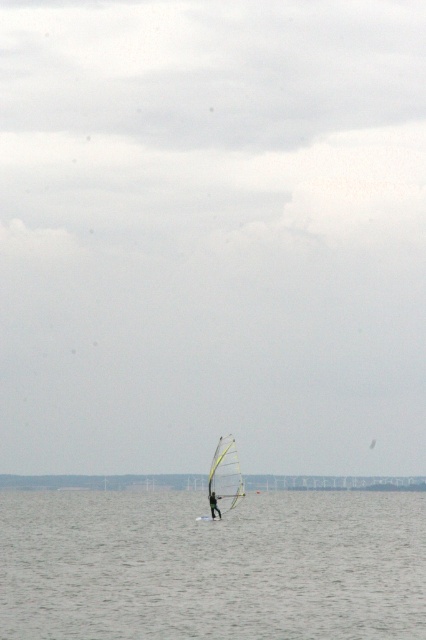
The height and width of the screenshot is (640, 426). What do you see at coordinates (224, 476) in the screenshot?
I see `white matte sail at center` at bounding box center [224, 476].

Describe the element at coordinates (224, 476) in the screenshot. I see `white matte sail at center` at that location.

Where is `white matte sail at center`? white matte sail at center is located at coordinates (224, 476).

Is clear water at center below white matte sail at center?

Indeed, clear water at center is positioned under white matte sail at center.

Does point (319, 500) come closer to viewer compared to point (218, 486)?

That is False.

Is point (368, 572) positioned after point (227, 476)?

That is False.

Identify the location of clear water at center. The height and width of the screenshot is (640, 426). (212, 564).

Who is shorter, clear water at center or green fabric sailboard at center?

With less height is green fabric sailboard at center.

Consider the image. Can you confirm if clear water at center is bigger than green fabric sailboard at center?

Correct, clear water at center is larger in size than green fabric sailboard at center.

What are the coordinates of `clear water at center` in the screenshot? It's located at (212, 564).